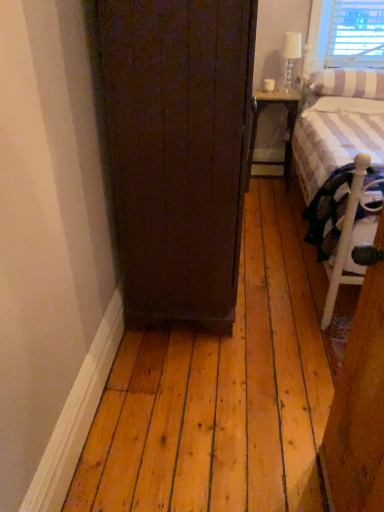
Question: Is striped fabric pillow at upper right outside white striped fabric at right?

Choices:
 (A) no
 (B) yes

Answer: (A)

Question: Is striped fabric pillow at upper right turned away from white striped fabric at right?

Choices:
 (A) yes
 (B) no

Answer: (A)

Question: Is striped fabric pillow at upper right oriented towards white striped fabric at right?

Choices:
 (A) no
 (B) yes

Answer: (B)

Question: From the image's perspective, is striped fabric pillow at upper right beneath white striped fabric at right?

Choices:
 (A) no
 (B) yes

Answer: (A)

Question: Is striped fabric pillow at upper right positioned far away from white striped fabric at right?

Choices:
 (A) yes
 (B) no

Answer: (B)

Question: Considering the positions of metallic gray nightstand at right and striped fabric pillow at upper right in the image, is metallic gray nightstand at right wider or thinner than striped fabric pillow at upper right?

Choices:
 (A) thin
 (B) wide

Answer: (A)

Question: From a real-world perspective, is metallic gray nightstand at right physically located above or below striped fabric pillow at upper right?

Choices:
 (A) below
 (B) above

Answer: (A)

Question: Is metallic gray nightstand at right inside the boundaries of striped fabric pillow at upper right, or outside?

Choices:
 (A) inside
 (B) outside

Answer: (B)

Question: Considering the positions of point (276, 97) and point (372, 84), is point (276, 97) closer or farther from the camera than point (372, 84)?

Choices:
 (A) closer
 (B) farther

Answer: (B)

Question: From the image's perspective, is metallic gray nightstand at right located above or below white striped fabric at right?

Choices:
 (A) above
 (B) below

Answer: (A)

Question: Would you say metallic gray nightstand at right is inside or outside white striped fabric at right?

Choices:
 (A) outside
 (B) inside

Answer: (A)

Question: Considering the positions of metallic gray nightstand at right and white striped fabric at right in the image, is metallic gray nightstand at right wider or thinner than white striped fabric at right?

Choices:
 (A) thin
 (B) wide

Answer: (A)

Question: Is point (288, 96) closer or farther from the camera than point (312, 148)?

Choices:
 (A) closer
 (B) farther

Answer: (B)

Question: Is striped fabric pillow at upper right bigger or smaller than metallic gray nightstand at right?

Choices:
 (A) small
 (B) big

Answer: (A)

Question: From a real-world perspective, relative to metallic gray nightstand at right, is striped fabric pillow at upper right vertically above or below?

Choices:
 (A) above
 (B) below

Answer: (A)